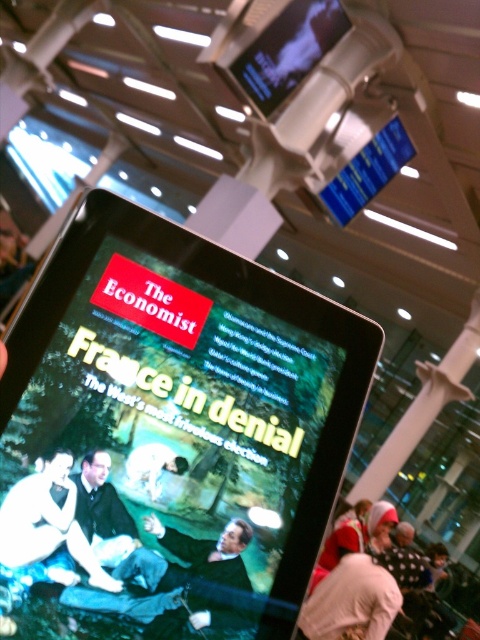
You are sitting on the green fabric couch at center and want to pick up the white cotton sweater at lower right. Is the sweater within arm reach from your current position?

The green fabric couch at center is in front of the white cotton sweater at lower right, so the sweater is behind the couch. Therefore, it is not within arm reach from your current position on the couch.

Looking at this image, you are sitting on the green fabric couch at center and want to read the tablet screen. Can you easily see the text on the black glossy tablet at center from your current position?

The black glossy tablet at center is positioned over green fabric couch at center, so yes, you can easily see the text on the black glossy tablet at center from your current position because it is placed above the couch.

You are standing in front of a tablet screen showing The Economist magazine cover. The tablet is at the center. There is a point at coordinates [169,435]. Is the tablet at that point?

Yes, the tablet at center is located at point [169,435].